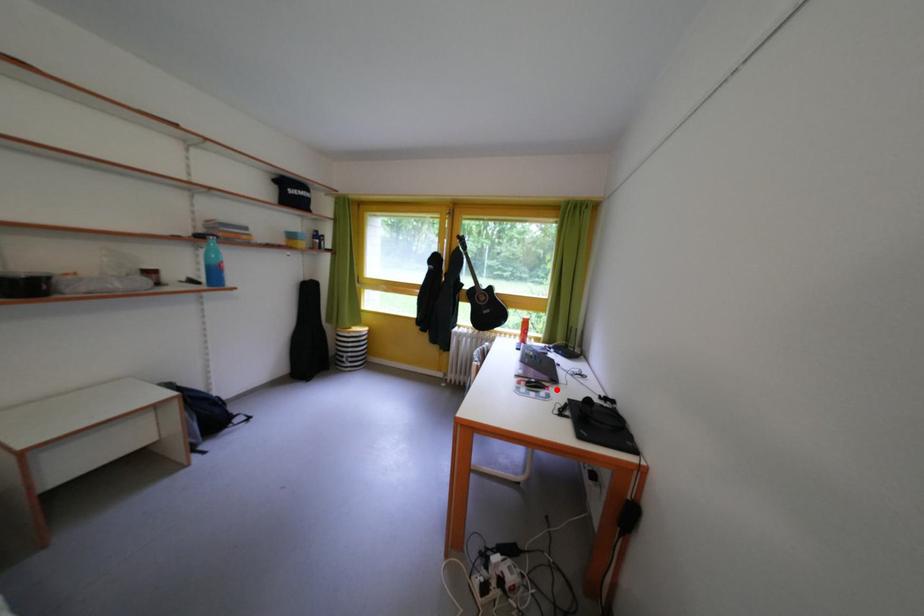
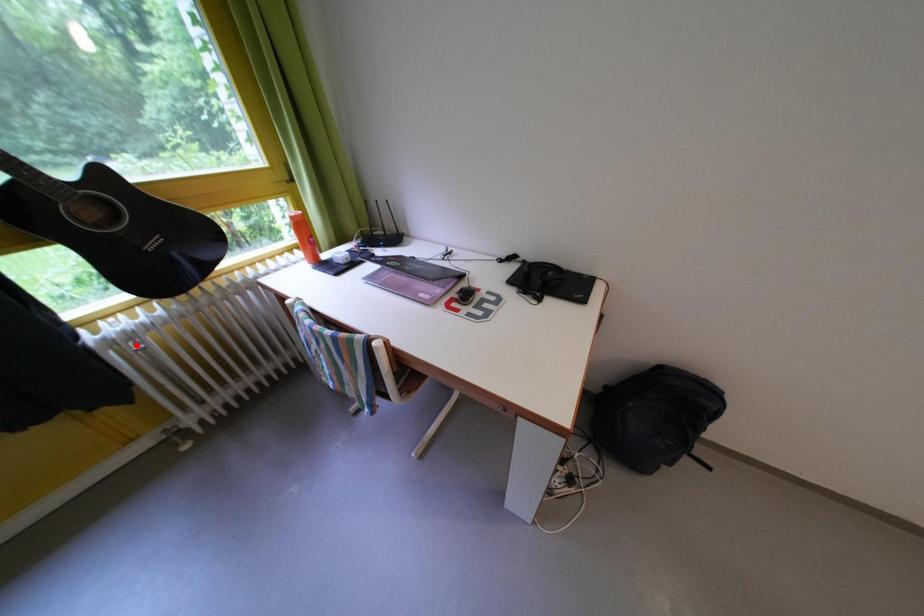
I am providing you with two images of the same scene from different viewpoints. A red point is marked on the first image and another point is marked on the second image. Is the red point in image1 aligned with the point shown in image2?

No